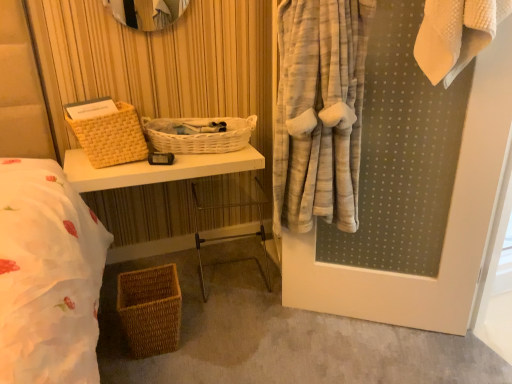
Find the location of a particular element. This screenshot has height=384, width=512. vacant area that is in front of clear plastic chair at center is located at coordinates (233, 321).